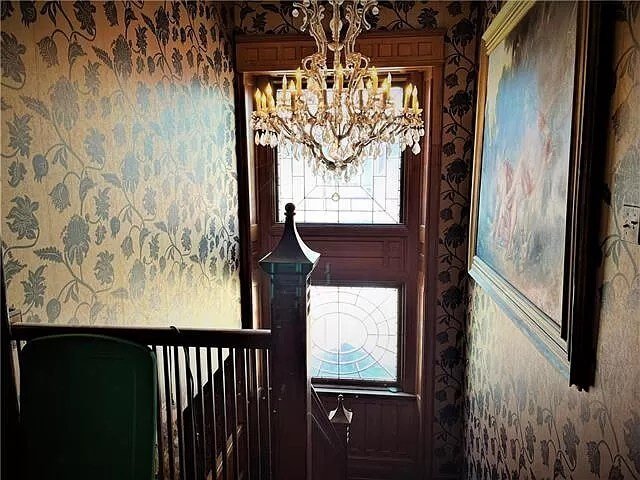
Image resolution: width=640 pixels, height=480 pixels. I want to click on glass windows in geometric designs, so click(369, 323), click(355, 187).